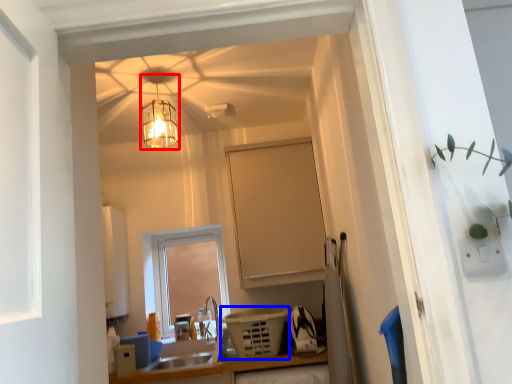
Question: Among these objects, which one is farthest to the camera, lamp (highlighted by a red box) or appliance (highlighted by a blue box)?

Choices:
 (A) lamp
 (B) appliance

Answer: (B)